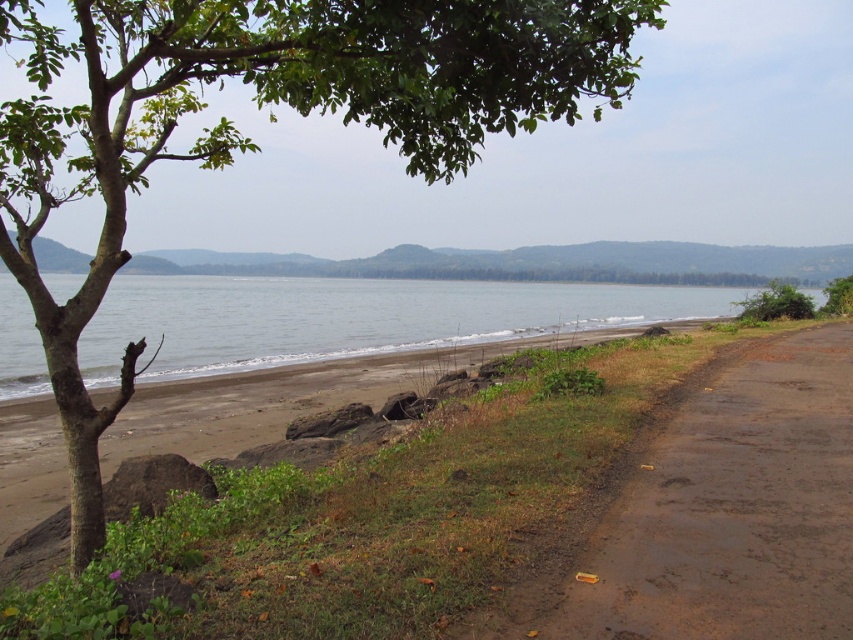
Who is more distant from viewer, (68, 276) or (811, 301)?

Point (68, 276)

The image size is (853, 640). I want to click on gray smooth water at center, so click(x=352, y=317).

Does green leafy tree at left have a larger size compared to green leafy tree at right?

Yes, green leafy tree at left is bigger than green leafy tree at right.

Locate an element on the screen. green leafy tree at left is located at coordinates (270, 108).

Which is above, dull brown asphalt at lower right or green leafy tree at right?

green leafy tree at right is higher up.

Is dull brown asphalt at lower right bigger than green leafy tree at right?

Indeed, dull brown asphalt at lower right has a larger size compared to green leafy tree at right.

The height and width of the screenshot is (640, 853). I want to click on dull brown asphalt at lower right, so click(733, 509).

Locate an element on the screen. dull brown asphalt at lower right is located at coordinates (733, 509).